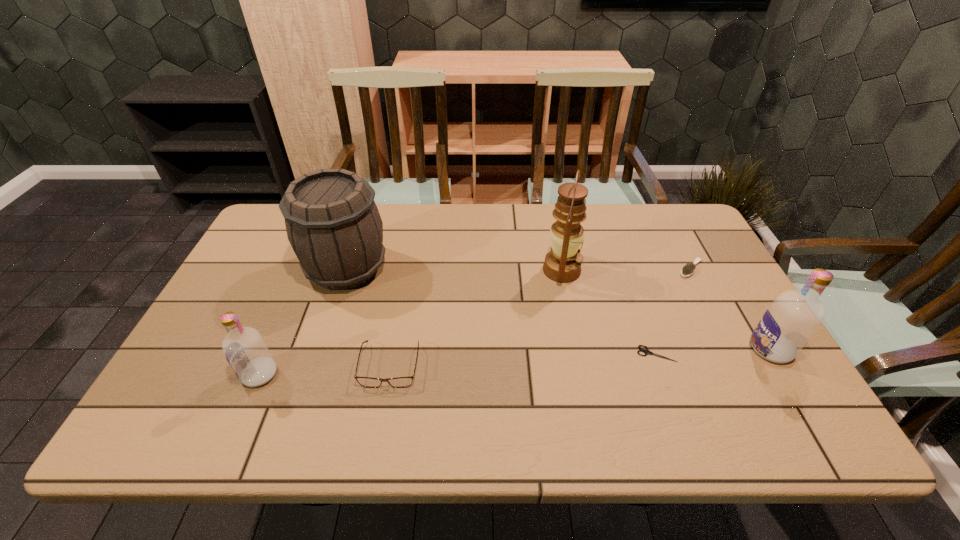
Where is `empty location between the scrubbing brush and the right vodka`? empty location between the scrubbing brush and the right vodka is located at coordinates (731, 309).

You are a GUI agent. You are given a task and a screenshot of the screen. Output one action in this format:
    pyautogui.click(x=<x>, y=<y>)
    Task: Click on the fourth closest object to the taller vodka
    
    Given the screenshot: What is the action you would take?
    click(x=400, y=382)

Locate an element on the screen. Image resolution: width=960 pixels, height=540 pixels. the third closest object relative to the shortest object is located at coordinates (688, 269).

The image size is (960, 540). Find the location of `free space that satisfies the following two spatial constraints: 1. on the lenses of the third shortest object; 2. on the label of the fourth shortest object`. free space that satisfies the following two spatial constraints: 1. on the lenses of the third shortest object; 2. on the label of the fourth shortest object is located at coordinates (389, 374).

Identify the location of free space that satisfies the following two spatial constraints: 1. on the label of the right vodka; 2. on the lenses of the third shortest object. (780, 365).

You are a GUI agent. You are given a task and a screenshot of the screen. Output one action in this format:
    pyautogui.click(x=<x>, y=<y>)
    Task: Click on the free space that satisfies the following two spatial constraints: 1. on the lenses of the spectacles; 2. on the label of the shorter vodka
    Image resolution: width=960 pixels, height=540 pixels.
    Given the screenshot: What is the action you would take?
    pyautogui.click(x=389, y=374)

Find the location of a particular element. The height and width of the screenshot is (540, 960). vacant space that satisfies the following two spatial constraints: 1. on the lenses of the third shortest object; 2. on the label of the left vodka is located at coordinates (389, 374).

Identify the location of vacant space that satisfies the following two spatial constraints: 1. on the lenses of the fifth tallest object; 2. on the label of the shorter vodka. [389, 374].